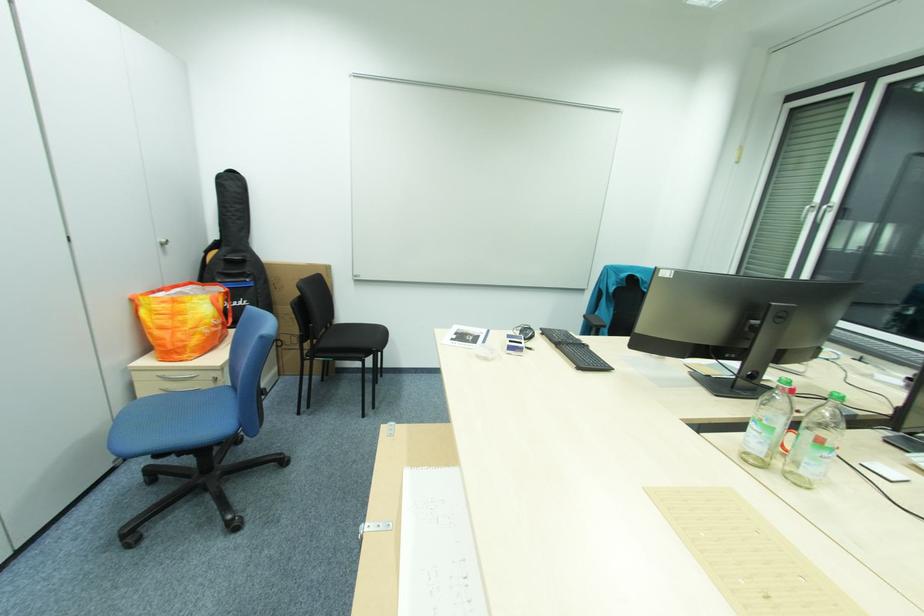
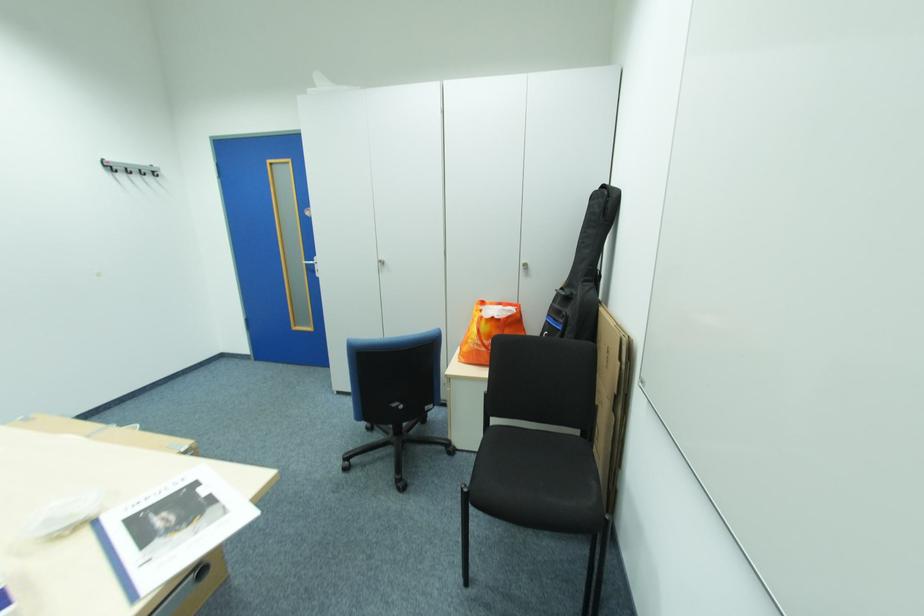
The point at (215, 331) is marked in the first image. Where is the corresponding point in the second image?

(480, 345)